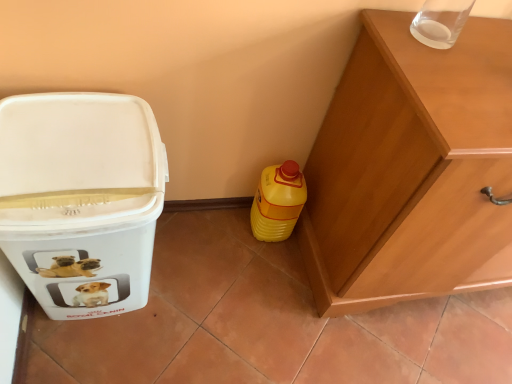
Question: Can you confirm if wooden cabinet at right is positioned to the right of white plastic container at left?

Choices:
 (A) yes
 (B) no

Answer: (A)

Question: From a real-world perspective, does wooden cabinet at right stand above white plastic container at left?

Choices:
 (A) yes
 (B) no

Answer: (A)

Question: Is wooden cabinet at right thinner than white plastic container at left?

Choices:
 (A) yes
 (B) no

Answer: (B)

Question: Is wooden cabinet at right located outside white plastic container at left?

Choices:
 (A) yes
 (B) no

Answer: (A)

Question: Is wooden cabinet at right wider than white plastic container at left?

Choices:
 (A) yes
 (B) no

Answer: (A)

Question: Is wooden cabinet at right placed right next to white plastic container at left?

Choices:
 (A) no
 (B) yes

Answer: (A)

Question: From the image's perspective, is yellow plastic bottle at lower right beneath wooden cabinet at right?

Choices:
 (A) no
 (B) yes

Answer: (B)

Question: Is yellow plastic bottle at lower right positioned in front of wooden cabinet at right?

Choices:
 (A) no
 (B) yes

Answer: (A)

Question: Could wooden cabinet at right be considered to be inside yellow plastic bottle at lower right?

Choices:
 (A) no
 (B) yes

Answer: (A)

Question: Does yellow plastic bottle at lower right appear on the right side of wooden cabinet at right?

Choices:
 (A) no
 (B) yes

Answer: (A)

Question: Can you confirm if yellow plastic bottle at lower right is positioned to the left of wooden cabinet at right?

Choices:
 (A) yes
 (B) no

Answer: (A)

Question: Is yellow plastic bottle at lower right positioned beyond the bounds of wooden cabinet at right?

Choices:
 (A) yes
 (B) no

Answer: (A)

Question: Is yellow plastic bottle at lower right aimed at white plastic container at left?

Choices:
 (A) yes
 (B) no

Answer: (B)